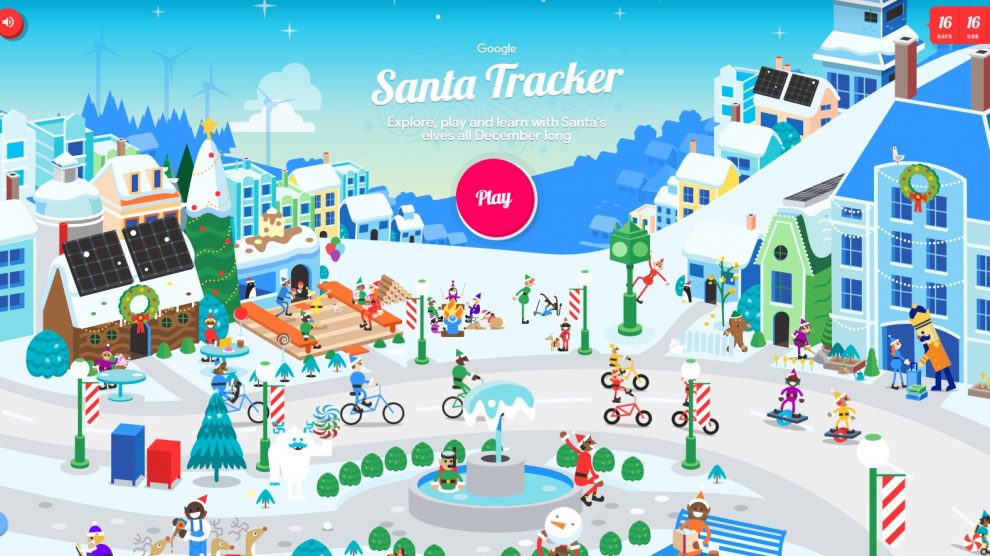
Where is `white snow on top of christmas tree`? This screenshot has height=556, width=990. white snow on top of christmas tree is located at coordinates (201, 192).